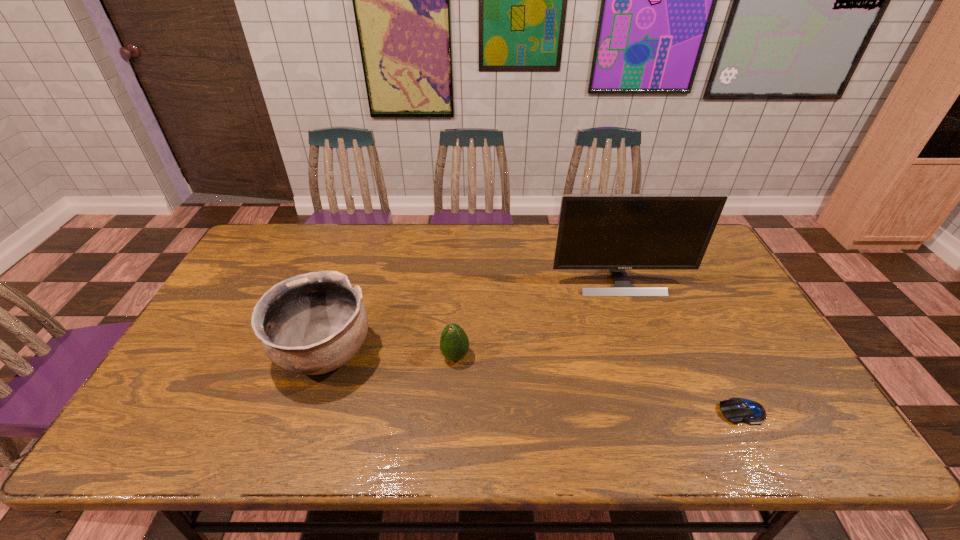
You are a GUI agent. You are given a task and a screenshot of the screen. Output one action in this format:
    pyautogui.click(x=<x>, y=<y>)
    Task: Click on the tallest object
    
    Given the screenshot: What is the action you would take?
    pyautogui.click(x=616, y=232)

Image resolution: width=960 pixels, height=540 pixels. Find the location of `monitor`. monitor is located at coordinates (616, 232).

This screenshot has width=960, height=540. Find the location of `pottery`. pottery is located at coordinates (310, 324).

The image size is (960, 540). In order to click on the leftmost object in this screenshot , I will do `click(310, 324)`.

Identify the location of avocado. The image size is (960, 540). (454, 344).

Identify the location of the third object from right to left. (454, 344).

Locate an element on the screen. The width and height of the screenshot is (960, 540). computer mouse is located at coordinates (736, 410).

Image resolution: width=960 pixels, height=540 pixels. I want to click on the nearest object, so click(x=736, y=410).

Locate an element on the screen. The height and width of the screenshot is (540, 960). free space located on the screen side of the monitor is located at coordinates (636, 326).

This screenshot has width=960, height=540. In order to click on vacant space situated 0.090m on the front of the pottery in this screenshot , I will do `click(299, 429)`.